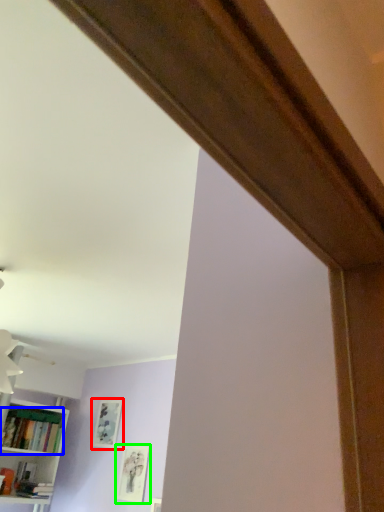
Question: Which object is positioned farthest from picture frame (highlighted by a red box)? Select from book (highlighted by a blue box) and picture frame (highlighted by a green box).

Choices:
 (A) book
 (B) picture frame

Answer: (A)